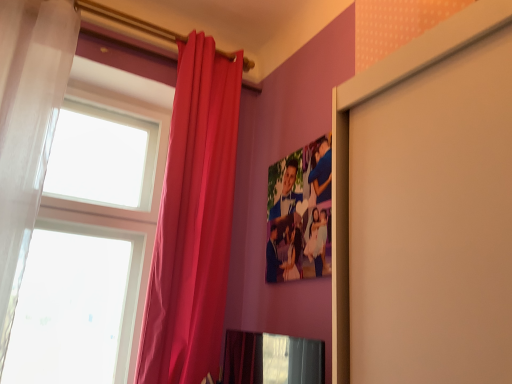
Question: Is point (203, 87) closer or farther from the camera than point (3, 311)?

Choices:
 (A) closer
 (B) farther

Answer: (B)

Question: Would you say matte pink curtain at upper left, which is the first curtain from right to left, is to the left or to the right of sheer white curtain at left, which ranks as the 1th curtain in left-to-right order, in the picture?

Choices:
 (A) right
 (B) left

Answer: (A)

Question: From a real-world perspective, is matte pink curtain at upper left, which is the first curtain from right to left, positioned above or below sheer white curtain at left, which ranks as the 1th curtain in left-to-right order?

Choices:
 (A) below
 (B) above

Answer: (A)

Question: Looking at their shapes, would you say sheer white curtain at left, arranged as the 2th curtain when viewed from the right, is wider or thinner than matte pink curtain at upper left, which ranks as the 2th curtain in left-to-right order?

Choices:
 (A) wide
 (B) thin

Answer: (A)

Question: From the image's perspective, is sheer white curtain at left, arranged as the 2th curtain when viewed from the right, above or below matte pink curtain at upper left, which is the first curtain from right to left?

Choices:
 (A) above
 (B) below

Answer: (A)

Question: Would you say sheer white curtain at left, which ranks as the 1th curtain in left-to-right order, is inside or outside matte pink curtain at upper left, which ranks as the 2th curtain in left-to-right order?

Choices:
 (A) outside
 (B) inside

Answer: (A)

Question: Considering their positions, is sheer white curtain at left, which ranks as the 1th curtain in left-to-right order, located in front of or behind matte pink curtain at upper left, which ranks as the 2th curtain in left-to-right order?

Choices:
 (A) behind
 (B) front

Answer: (B)